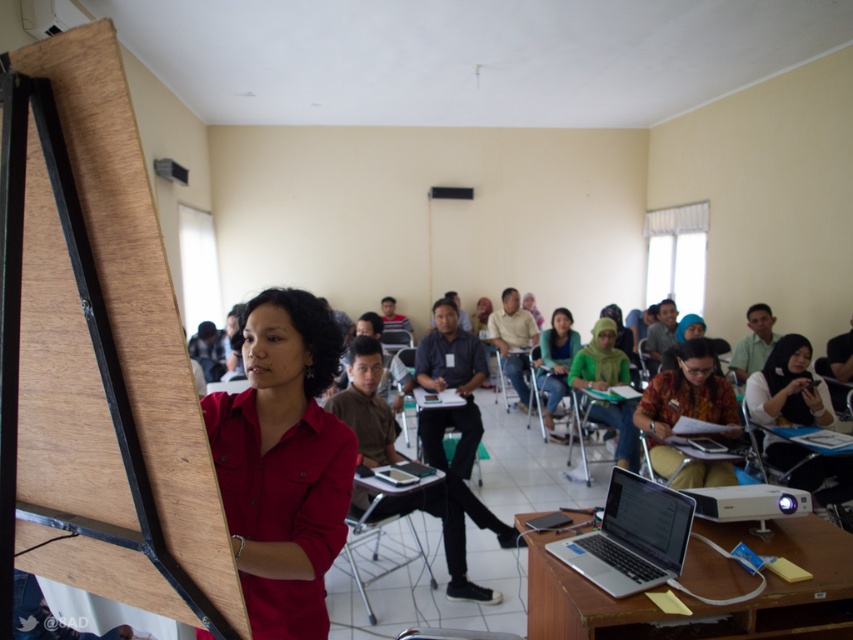
Question: Can you confirm if matte red shirt at center is wider than silver metallic table at lower right?

Choices:
 (A) no
 (B) yes

Answer: (A)

Question: Which of the following is the farthest from the observer?

Choices:
 (A) matte red shirt at center
 (B) matte brown blouse at center
 (C) silver metallic table at lower right

Answer: (B)

Question: Which of the following is the farthest from the observer?

Choices:
 (A) matte black hijab at center
 (B) light brown wood chair at center

Answer: (B)

Question: Where is silver metallic laptop at lower right located in relation to matte black hijab at center in the image?

Choices:
 (A) below
 (B) above

Answer: (A)

Question: Which of the following is the closest to the observer?

Choices:
 (A) 552,417
 (B) 624,424

Answer: (B)

Question: Is matte red shirt at center positioned in front of matte green shirt at center?

Choices:
 (A) no
 (B) yes

Answer: (B)